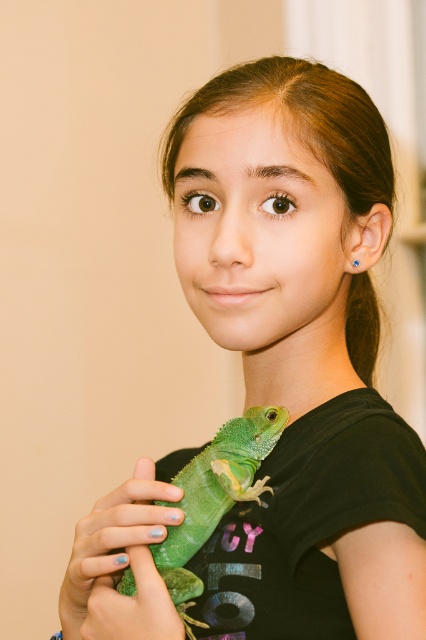
Question: Which point is closer to the camera?

Choices:
 (A) (123, 616)
 (B) (244, 435)

Answer: (A)

Question: Is green matte lizard at lower left thinner than green matte lizard at center?

Choices:
 (A) yes
 (B) no

Answer: (A)

Question: Can you confirm if green matte lizard at lower left is thinner than green matte lizard at center?

Choices:
 (A) no
 (B) yes

Answer: (B)

Question: Among these objects, which one is farthest from the camera?

Choices:
 (A) green matte lizard at lower left
 (B) green matte lizard at center

Answer: (B)

Question: Is green matte lizard at lower left to the right of green matte lizard at center from the viewer's perspective?

Choices:
 (A) yes
 (B) no

Answer: (B)